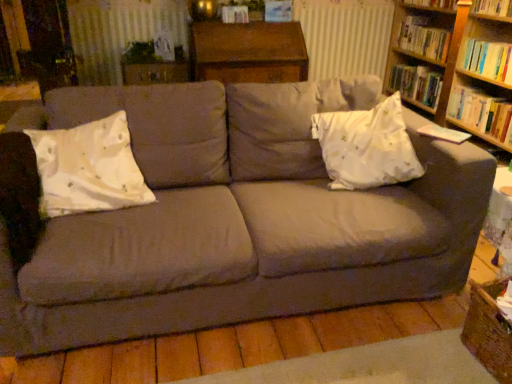
Question: Considering the positions of white satin pillow at right, the 1th throw pillow in the right-to-left sequence, and hardcover book at right, acting as the 5th book starting from the top, in the image, is white satin pillow at right, the 1th throw pillow in the right-to-left sequence, wider or thinner than hardcover book at right, acting as the 5th book starting from the top,?

Choices:
 (A) thin
 (B) wide

Answer: (B)

Question: Is point (411, 162) positioned closer to the camera than point (471, 87)?

Choices:
 (A) farther
 (B) closer

Answer: (B)

Question: Which of these objects is positioned farthest from the hardcover book at upper center?

Choices:
 (A) hardcover book at upper right, the second book in the bottom-to-top sequence
 (B) hardcover book at upper right, which ranks as the fifth book in bottom-to-top order
 (C) velvet gray couch at center
 (D) hardcover book at right, the first book positioned from the bottom
 (E) white satin pillow at left, arranged as the second throw pillow when viewed from the right

Answer: (C)

Question: Which of these objects is positioned farthest from the hardcover book at right, the first book positioned from the bottom?

Choices:
 (A) wooden dresser at upper center
 (B) hardcover book at upper right, which ranks as the fifth book in bottom-to-top order
 (C) velvet gray couch at center
 (D) white satin pillow at left, arranged as the second throw pillow when viewed from the right
 (E) hardcover book at upper center

Answer: (D)